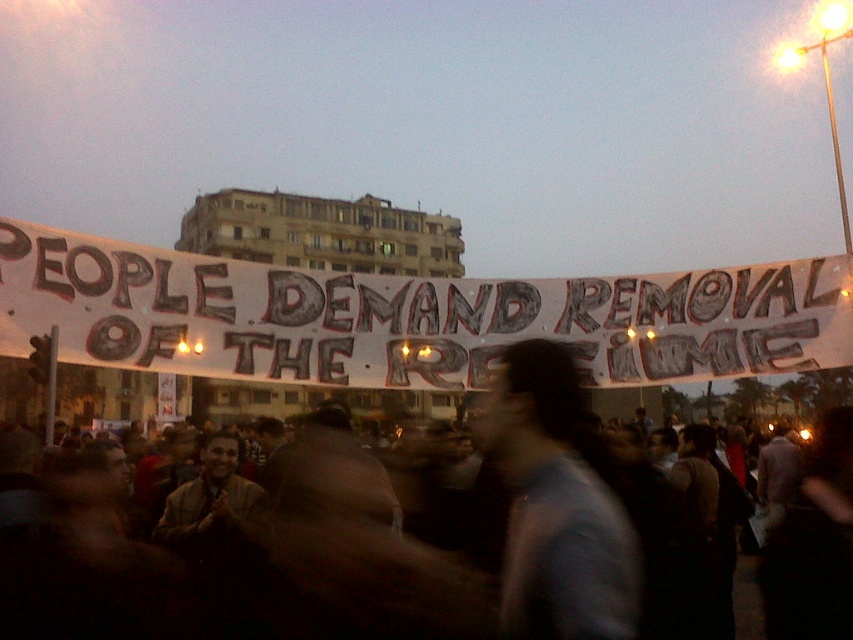
You are a photographer trying to capture the protest scene. The white paper banner at center is crucial for your shot. Given that your camera has a focus point at the center of the frame, which is at coordinates point 0.5, 0.5, will the banner be in focus?

The white paper banner at center is positioned at point (408, 317), which is very close to the camera focus point at (426, 320). Therefore, the banner will be in focus.

Looking at this image, you are a journalist trying to capture the protest scene. You notice the gray matte shirt at center and the black fabric crowd at center. From your vantage point, which object is positioned to the right of the other?

The gray matte shirt at center is to the right of the black fabric crowd at center.

You are a photographer trying to capture the protest scene. You notice the gray matte shirt at center and the black fabric crowd at center. Which object should you focus on to ensure the subject in the foreground is sharp?

The gray matte shirt at center is above the black fabric crowd at center, so focusing on the gray matte shirt at center will ensure the foreground subject is sharp.